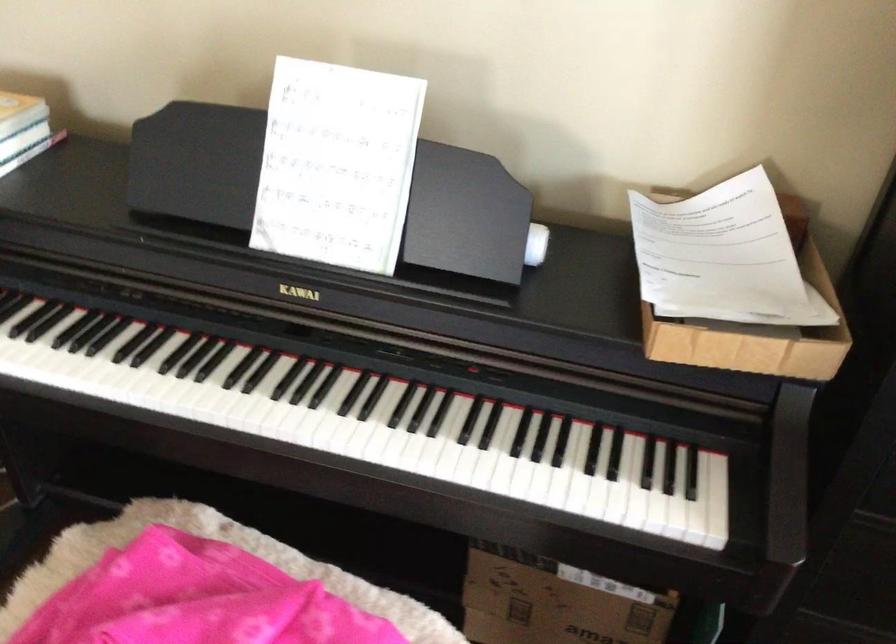
What do you see at coordinates (466, 214) in the screenshot?
I see `a black music stand` at bounding box center [466, 214].